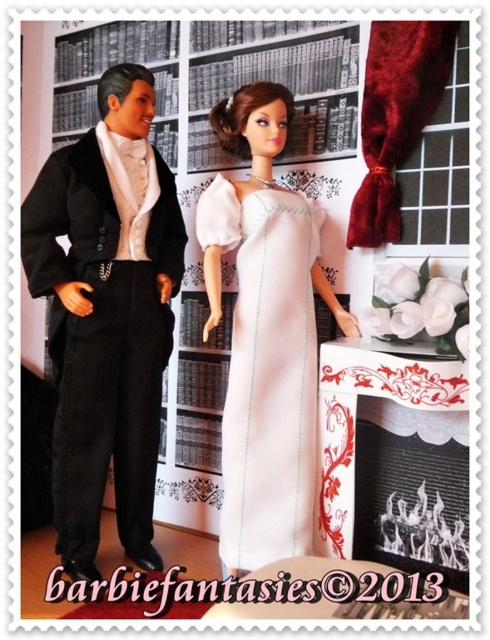
Question: Is satin black suit at left below velvet black tuxedo at left?

Choices:
 (A) yes
 (B) no

Answer: (A)

Question: Does satin black suit at left appear on the right side of white satin dress at center?

Choices:
 (A) yes
 (B) no

Answer: (B)

Question: Does satin black suit at left appear on the left side of velvet black tuxedo at left?

Choices:
 (A) yes
 (B) no

Answer: (B)

Question: Considering the real-world distances, which object is farthest from the satin black suit at left?

Choices:
 (A) velvet black tuxedo at left
 (B) white satin dress at center

Answer: (B)

Question: Among these points, which one is nearest to the camera?

Choices:
 (A) (223, 180)
 (B) (96, 504)

Answer: (A)

Question: Which object is positioned closest to the velvet black tuxedo at left?

Choices:
 (A) satin black suit at left
 (B) white satin dress at center

Answer: (A)